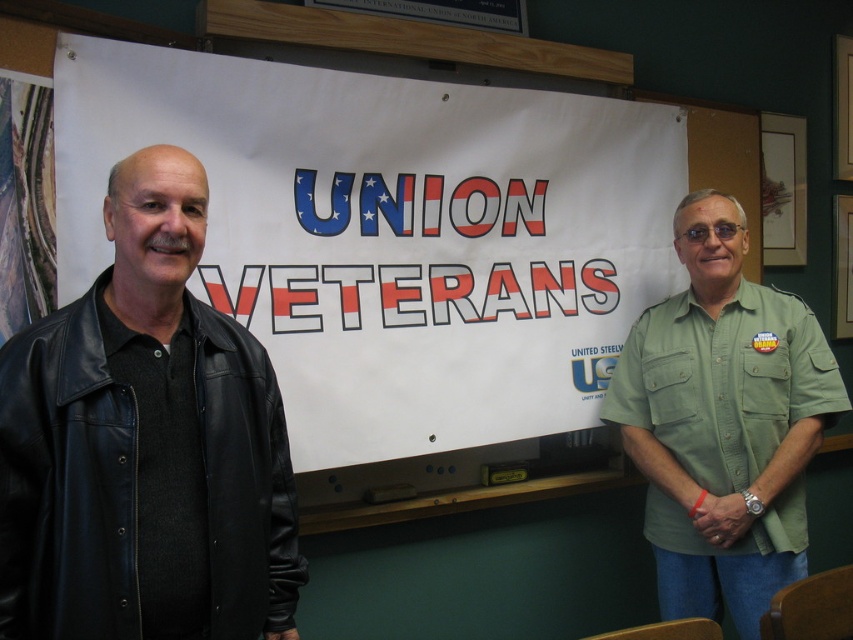
From the picture: Who is more distant from viewer, (119, 547) or (672, 564)?

The point (672, 564) is more distant.

Where is `black leather jacket at left`? Image resolution: width=853 pixels, height=640 pixels. black leather jacket at left is located at coordinates (144, 445).

Locate an element on the screen. black leather jacket at left is located at coordinates coord(144,445).

Who is positioned more to the right, white paper at center or green uniform shirt at right?

green uniform shirt at right is more to the right.

Can you confirm if white paper at center is positioned below green uniform shirt at right?

No, white paper at center is not below green uniform shirt at right.

Describe the element at coordinates (392, 236) in the screenshot. I see `white paper at center` at that location.

Image resolution: width=853 pixels, height=640 pixels. I want to click on white paper at center, so pos(392,236).

Is white paper at center to the left of black leather jacket at left from the viewer's perspective?

Incorrect, white paper at center is not on the left side of black leather jacket at left.

Between white paper at center and black leather jacket at left, which one has more height?

white paper at center

Between point (422, 387) and point (171, 349), which one is positioned behind?

Point (422, 387)

At what (x,y) coordinates should I click in order to perform the action: click on white paper at center. Please return your answer as a coordinate pair (x, y). The width and height of the screenshot is (853, 640). Looking at the image, I should click on (392, 236).